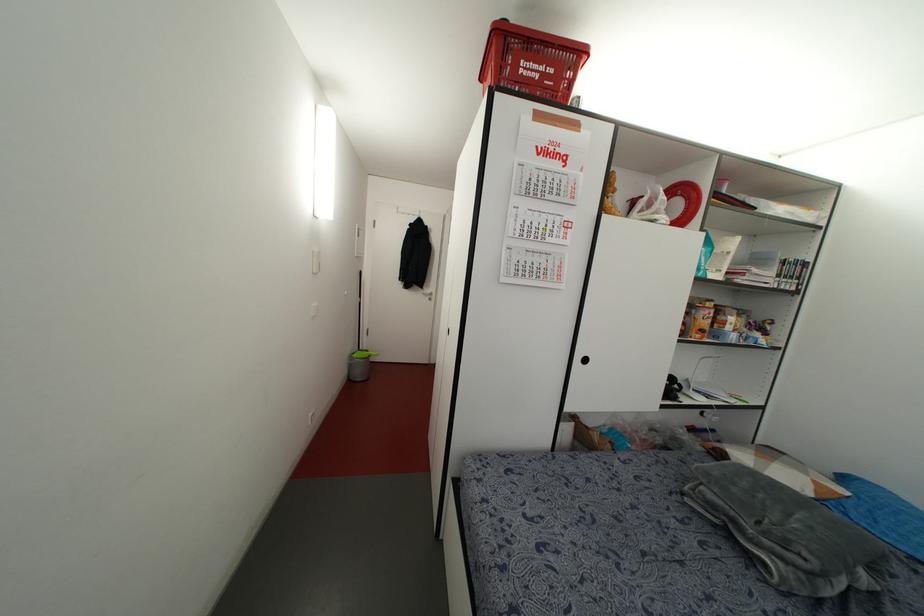
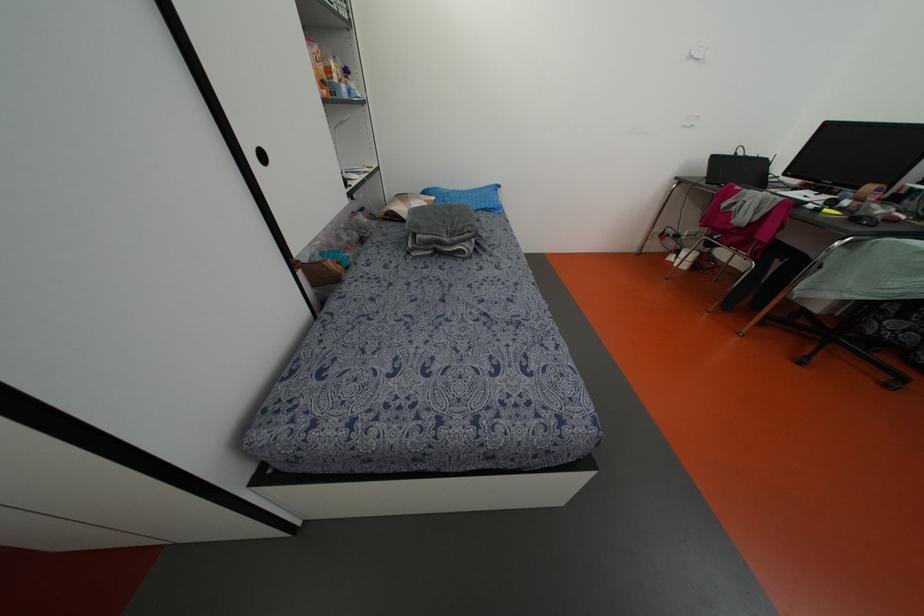
Locate, in the second image, the point that corresponds to pixel 770 451 in the first image.

(402, 197)